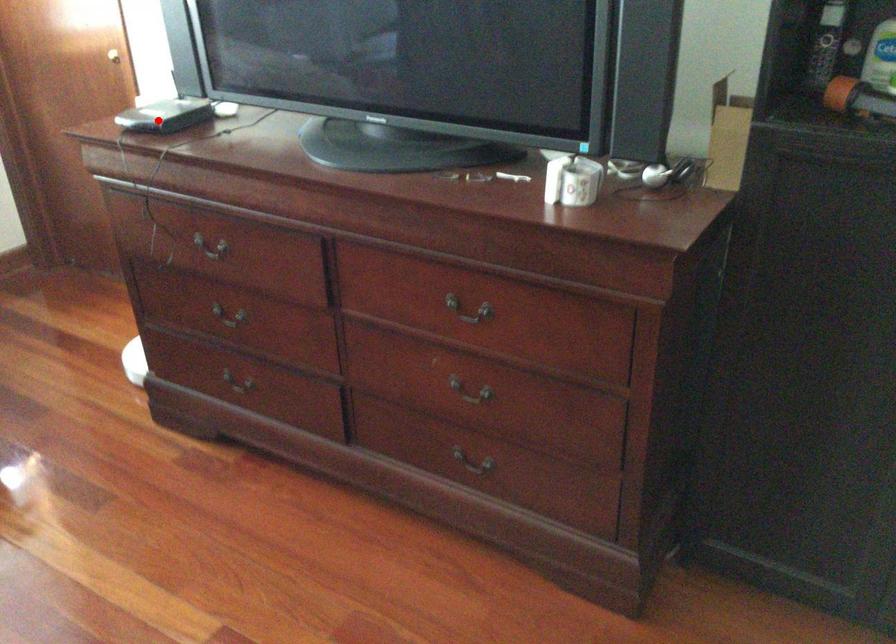
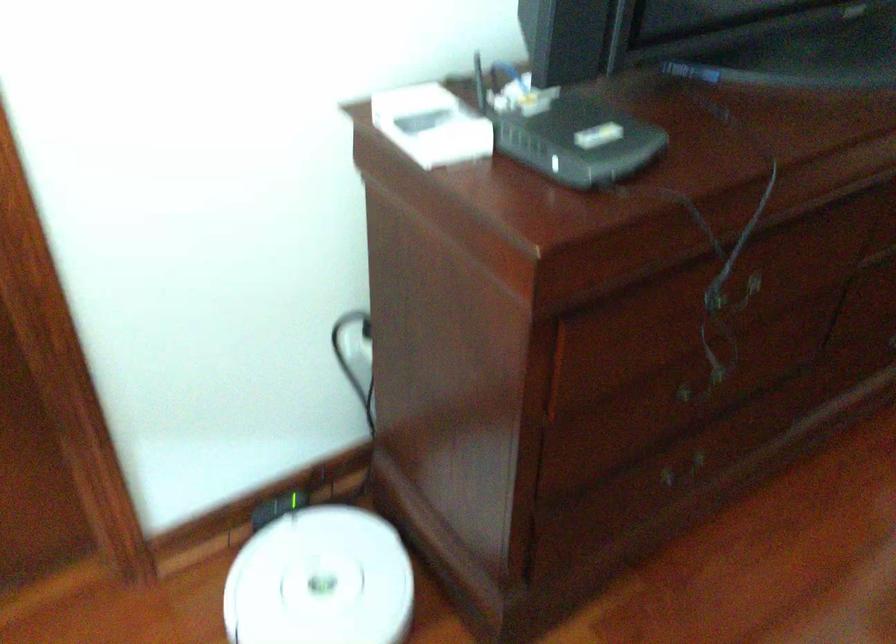
Question: I am providing you with two images of the same scene from different viewpoints. Image1 has a red point marked. In image2, the corresponding 3D location appears at what relative position? Reply with the corresponding letter.

Choices:
 (A) Closer
 (B) Farther

Answer: (A)